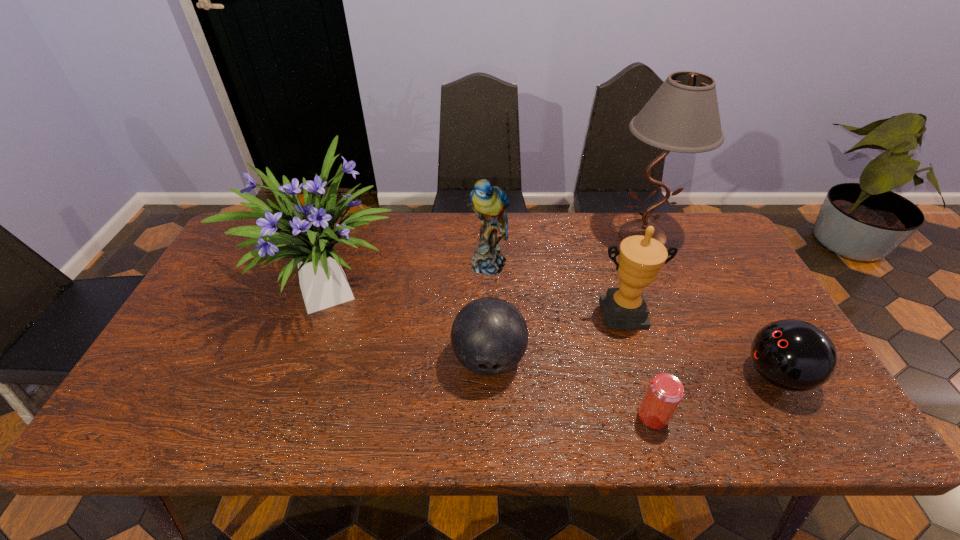
At what (x,y) coordinates should I click in order to perform the action: click on table lamp. Please return your answer as a coordinate pair (x, y). The width and height of the screenshot is (960, 540). Looking at the image, I should click on (682, 116).

I want to click on flower arrangement, so click(x=306, y=233).

The width and height of the screenshot is (960, 540). Identify the location of the second tallest object. (306, 233).

Locate an element on the screen. Image resolution: width=960 pixels, height=540 pixels. parrot is located at coordinates (489, 202).

At what (x,y) coordinates should I click in order to perform the action: click on award. Please return your answer as a coordinate pair (x, y). Image resolution: width=960 pixels, height=540 pixels. Looking at the image, I should click on (641, 258).

Identify the location of the left bowling ball. (489, 336).

The width and height of the screenshot is (960, 540). Identify the location of the right bowling ball. coord(794,355).

Where is `the shortest object`? This screenshot has width=960, height=540. the shortest object is located at coordinates (665, 392).

What are the coordinates of `vacant space located on the front-facing side of the table lamp` in the screenshot? It's located at (684, 335).

The image size is (960, 540). What are the coordinates of `vacant space situated 0.060m on the front of the leftmost object` in the screenshot? It's located at (309, 363).